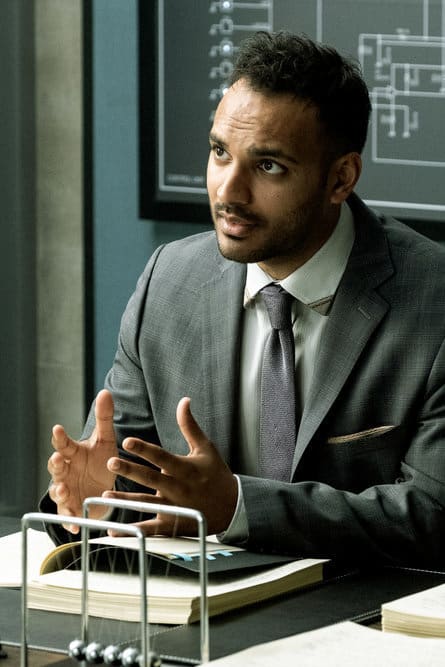
Locate an element on the screen. This screenshot has width=445, height=667. book is located at coordinates (167, 581).